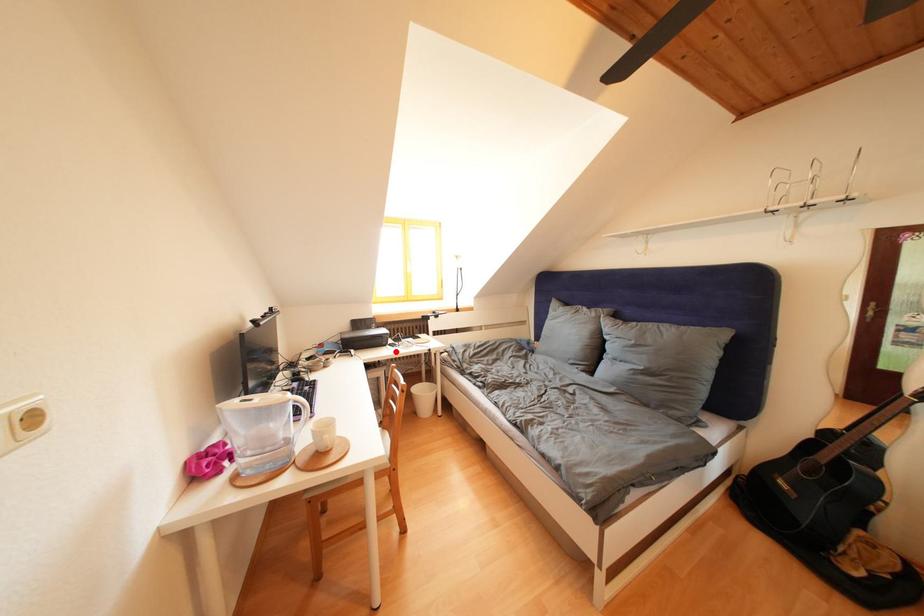
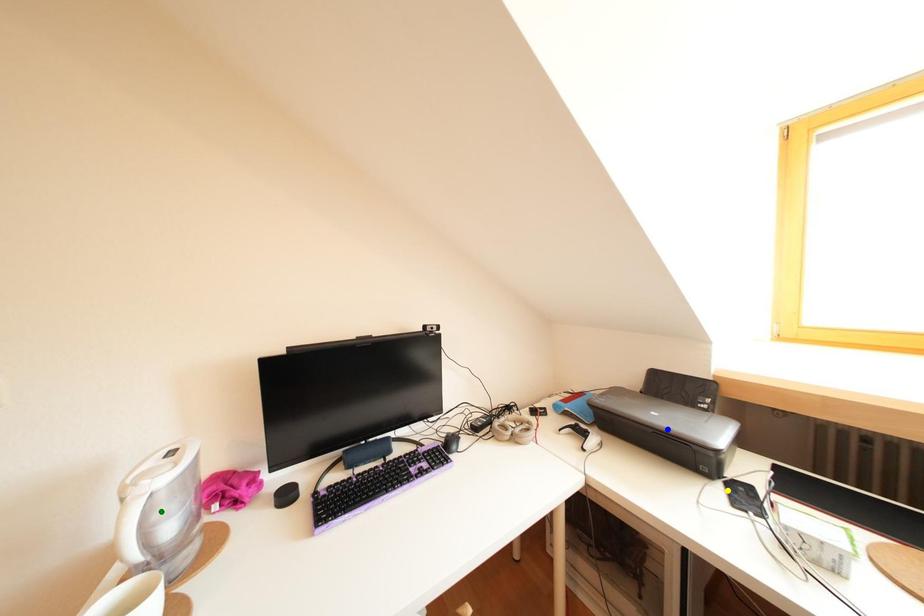
Question: I am providing you with two images of the same scene from different viewpoints. A red point is marked on the first image. You are given multiple points on the second image. Which point in image 2 represents the same 3d spot as the red point in image 1?

Choices:
 (A) blue point
 (B) green point
 (C) yellow point

Answer: (C)